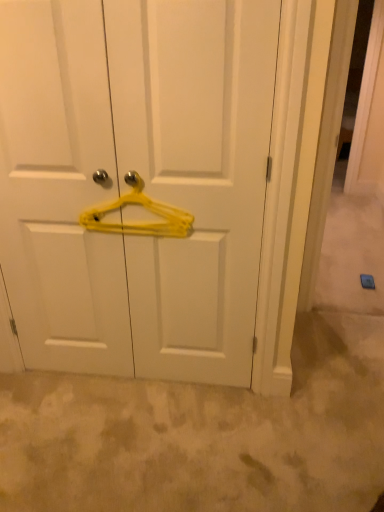
Question: Relative to yellow plastic hanger at center, is yellow plastic hanger at center in front or behind?

Choices:
 (A) front
 (B) behind

Answer: (B)

Question: Considering the positions of yellow plastic hanger at center and yellow plastic hanger at center in the image, is yellow plastic hanger at center taller or shorter than yellow plastic hanger at center?

Choices:
 (A) short
 (B) tall

Answer: (A)

Question: From a real-world perspective, is yellow plastic hanger at center above or below yellow plastic hanger at center?

Choices:
 (A) below
 (B) above

Answer: (B)

Question: In terms of width, does yellow plastic hanger at center look wider or thinner when compared to yellow plastic hanger at center?

Choices:
 (A) wide
 (B) thin

Answer: (A)

Question: In the image, is yellow plastic hanger at center positioned in front of or behind yellow plastic hanger at center?

Choices:
 (A) behind
 (B) front

Answer: (B)

Question: Based on their positions, is yellow plastic hanger at center located to the left or right of yellow plastic hanger at center?

Choices:
 (A) left
 (B) right

Answer: (A)

Question: Would you say yellow plastic hanger at center is inside or outside yellow plastic hanger at center?

Choices:
 (A) outside
 (B) inside

Answer: (A)